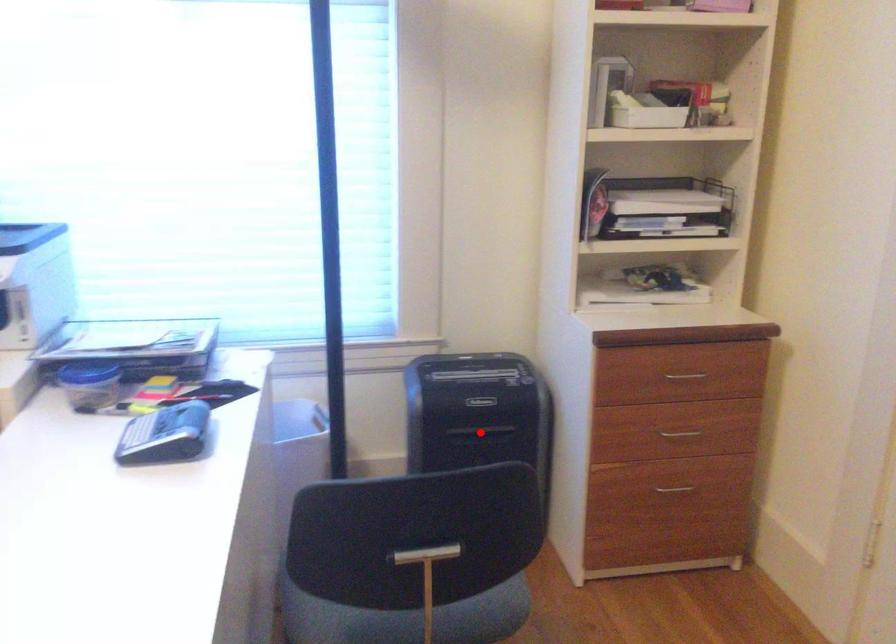
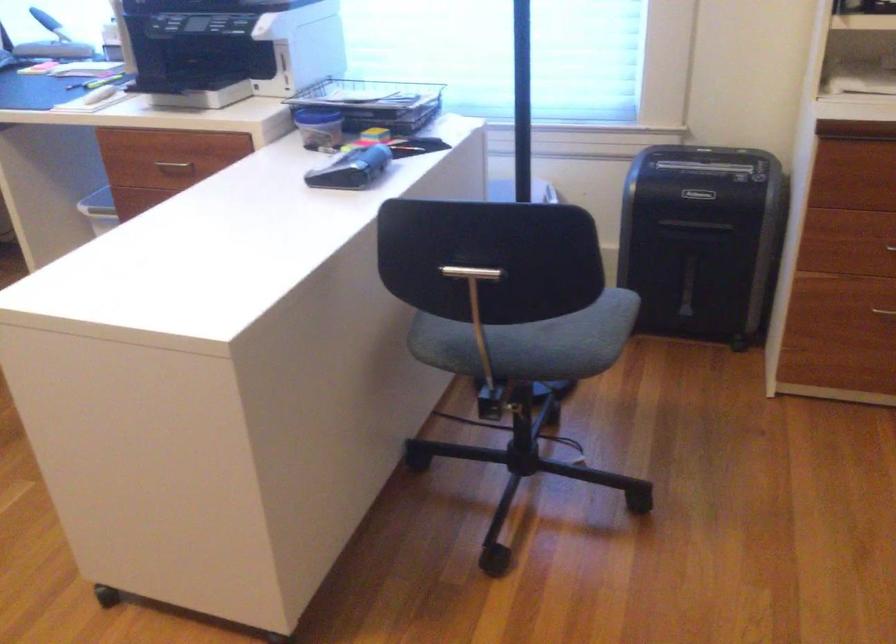
Where in the second image is the point corresponding to the highlighted location from the first image?

(693, 225)